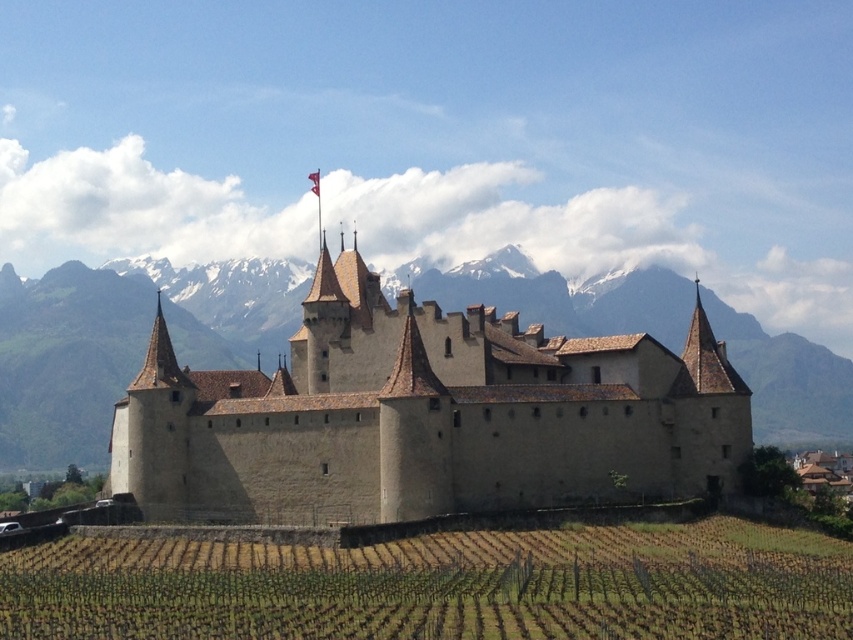
Between point (173, 419) and point (131, 544), which one is positioned behind?

The point (173, 419) is more distant.

Who is higher up, beige stone castle at center or green grassy vineyard at lower center?

beige stone castle at center is above.

Is point (608, 346) less distant than point (798, 625)?

No, (608, 346) is behind (798, 625).

Identify the location of beige stone castle at center. The width and height of the screenshot is (853, 640). (426, 417).